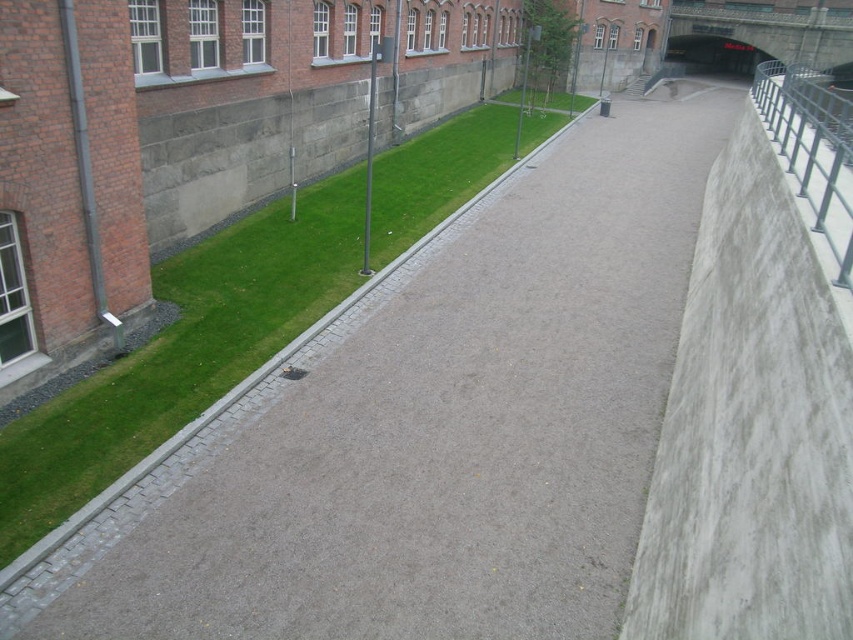
You are standing at the starting point of the pathway and want to reach the end of the pathway. Which point, point (286, 284) or point (288, 369), is closer to your current position?

Point (288, 369) is closer to your current position because it is in front of point (286, 284).

You are a delivery person with a cart that is 1.2 meters wide. You need to navigate through the pathway in the image. Can your cart fit between the green grass at center and the metallic gray bench at lower center?

The green grass at center is bigger than the metallic gray bench at lower center, so the space between them is sufficient for the cart to pass through.

You are a pedestrian standing on the pathway and want to sit down. You see the green grass at center and the metallic gray bench at lower center. Which one is closer to you?

The green grass at center is in front of the metallic gray bench at lower center, so the metallic gray bench at lower center is closer to you.